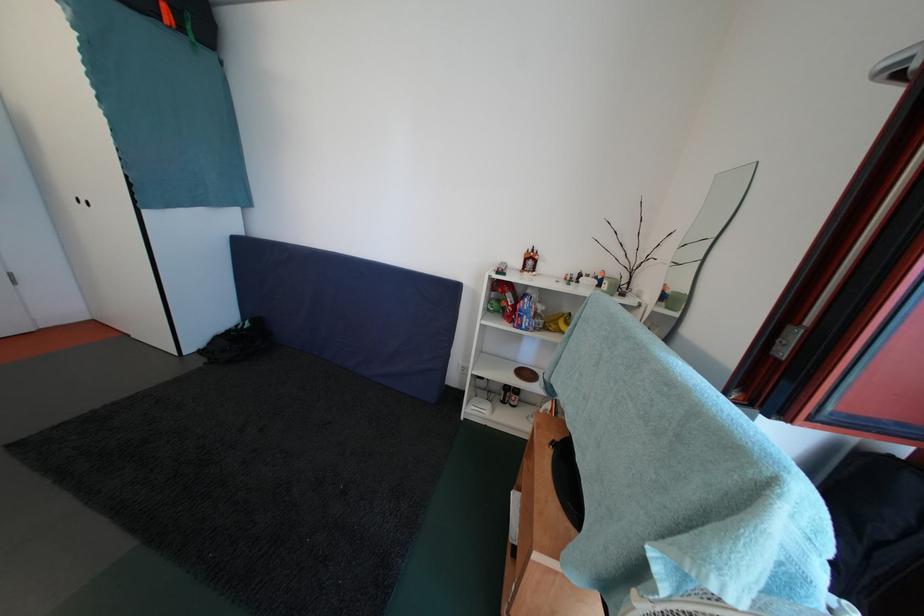
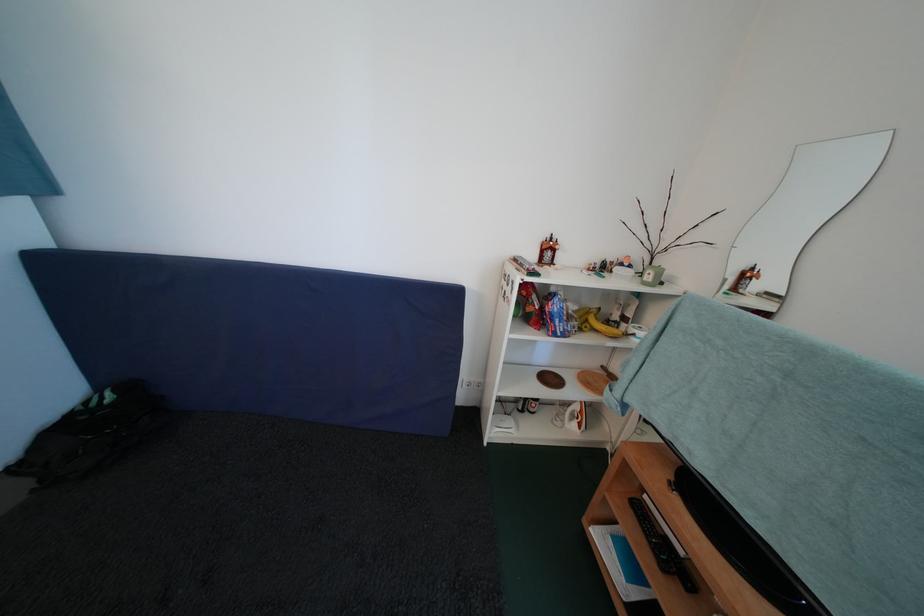
Question: How did the camera likely rotate?

Choices:
 (A) Left
 (B) Right
 (C) Up
 (D) Down

Answer: (B)